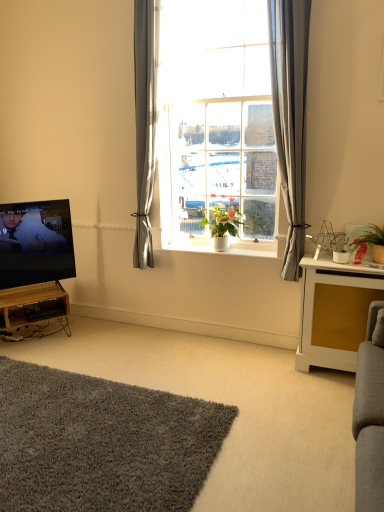
Question: Is gray fabric curtain at center to the left of white textured cabinet at right, arranged as the second table when viewed from the left, from the viewer's perspective?

Choices:
 (A) no
 (B) yes

Answer: (B)

Question: From a real-world perspective, is gray fabric curtain at center on top of white textured cabinet at right, positioned as the 1th table in front-to-back order?

Choices:
 (A) no
 (B) yes

Answer: (B)

Question: Is white textured cabinet at right, which is counted as the first table, starting from the right, surrounded by gray fabric curtain at center?

Choices:
 (A) no
 (B) yes

Answer: (A)

Question: Is gray fabric curtain at center facing towards white textured cabinet at right, arranged as the second table when viewed from the left?

Choices:
 (A) no
 (B) yes

Answer: (A)

Question: From the image's perspective, is gray fabric curtain at center under white textured cabinet at right, arranged as the second table when viewed from the left?

Choices:
 (A) no
 (B) yes

Answer: (A)

Question: Is gray fabric curtain at center looking in the opposite direction of white textured cabinet at right, which is the 2th table in back-to-front order?

Choices:
 (A) no
 (B) yes

Answer: (A)

Question: From the image's perspective, is clear glass window at center below wooden at left, which is counted as the first table, starting from the left?

Choices:
 (A) yes
 (B) no

Answer: (B)

Question: Is clear glass window at center bigger than wooden at left, which is counted as the 2th table, starting from the right?

Choices:
 (A) no
 (B) yes

Answer: (B)

Question: From a real-world perspective, is clear glass window at center located beneath wooden at left, which is counted as the first table, starting from the left?

Choices:
 (A) no
 (B) yes

Answer: (A)

Question: Does clear glass window at center have a lesser height compared to wooden at left, which is counted as the 2th table, starting from the front?

Choices:
 (A) no
 (B) yes

Answer: (A)

Question: Does clear glass window at center have a lesser width compared to wooden at left, positioned as the first table in back-to-front order?

Choices:
 (A) no
 (B) yes

Answer: (B)

Question: Can you confirm if clear glass window at center is wider than wooden at left, which is counted as the 2th table, starting from the right?

Choices:
 (A) no
 (B) yes

Answer: (A)

Question: From the image's perspective, does soft gray carpet at lower left appear higher than clear glass window at center?

Choices:
 (A) no
 (B) yes

Answer: (A)